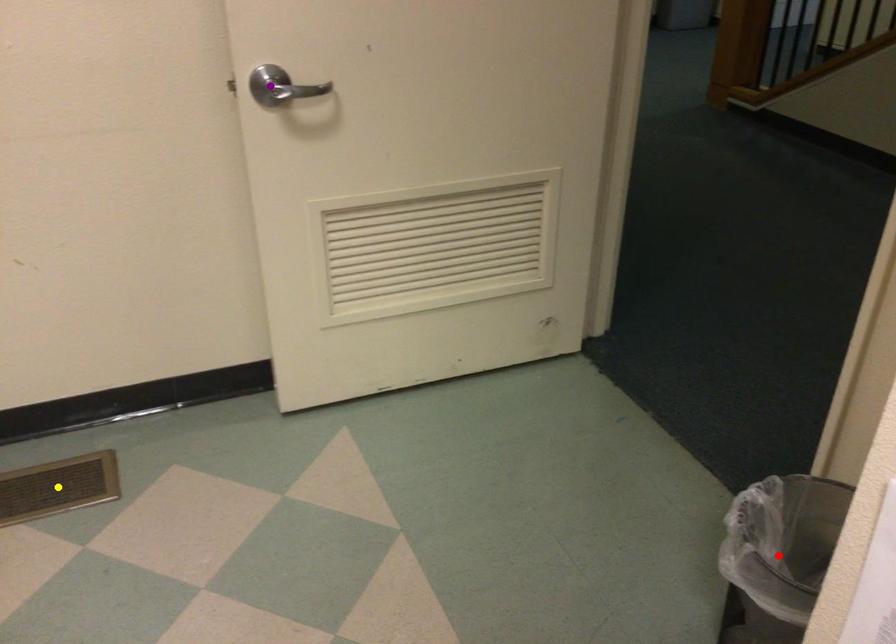
Order these from nearest to farthest:
purple point
red point
yellow point

red point, purple point, yellow point